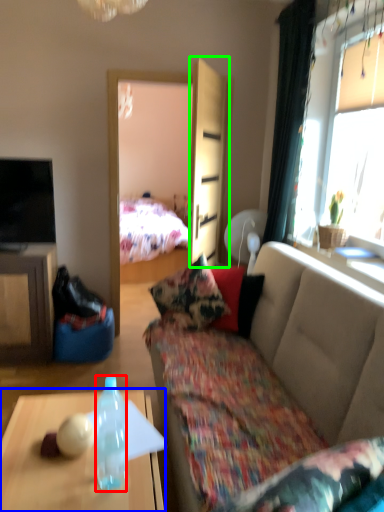
Question: Which object is positioned farthest from bottle (highlighted by a red box)? Select from desk (highlighted by a blue box) and armoire (highlighted by a green box).

Choices:
 (A) desk
 (B) armoire

Answer: (B)